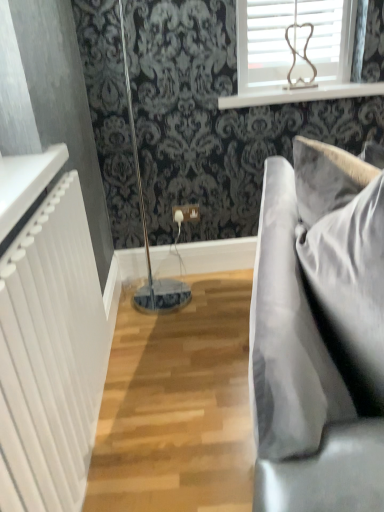
Question: Can you confirm if velvet gray pillow at right is taller than white textured radiator at left?

Choices:
 (A) yes
 (B) no

Answer: (B)

Question: From the image's perspective, does velvet gray pillow at right appear higher than white textured radiator at left?

Choices:
 (A) no
 (B) yes

Answer: (B)

Question: Can you confirm if velvet gray pillow at right is positioned to the left of white textured radiator at left?

Choices:
 (A) no
 (B) yes

Answer: (A)

Question: From a real-world perspective, does velvet gray pillow at right stand above white textured radiator at left?

Choices:
 (A) no
 (B) yes

Answer: (B)

Question: From the image's perspective, is velvet gray pillow at right beneath white textured radiator at left?

Choices:
 (A) no
 (B) yes

Answer: (A)

Question: From the image's perspective, relative to white wood window sill at upper center, is velvet gray pillow at right above or below?

Choices:
 (A) above
 (B) below

Answer: (B)

Question: Considering the relative positions of velvet gray pillow at right and white wood window sill at upper center in the image provided, is velvet gray pillow at right to the left or to the right of white wood window sill at upper center?

Choices:
 (A) right
 (B) left

Answer: (B)

Question: Considering the positions of point (327, 330) and point (382, 88), is point (327, 330) closer or farther from the camera than point (382, 88)?

Choices:
 (A) closer
 (B) farther

Answer: (A)

Question: Considering the positions of velvet gray pillow at right and white wood window sill at upper center in the image, is velvet gray pillow at right taller or shorter than white wood window sill at upper center?

Choices:
 (A) short
 (B) tall

Answer: (B)

Question: Is velvet grey couch at right inside the boundaries of white wood window sill at upper center, or outside?

Choices:
 (A) outside
 (B) inside

Answer: (A)

Question: Based on their sizes in the image, would you say velvet grey couch at right is bigger or smaller than white wood window sill at upper center?

Choices:
 (A) small
 (B) big

Answer: (B)

Question: Is velvet grey couch at right taller or shorter than white wood window sill at upper center?

Choices:
 (A) tall
 (B) short

Answer: (A)

Question: From a real-world perspective, is velvet grey couch at right positioned above or below white wood window sill at upper center?

Choices:
 (A) above
 (B) below

Answer: (B)

Question: Would you say white textured radiator at left is inside or outside velvet grey couch at right?

Choices:
 (A) inside
 (B) outside

Answer: (B)

Question: In terms of size, does white textured radiator at left appear bigger or smaller than velvet grey couch at right?

Choices:
 (A) big
 (B) small

Answer: (B)